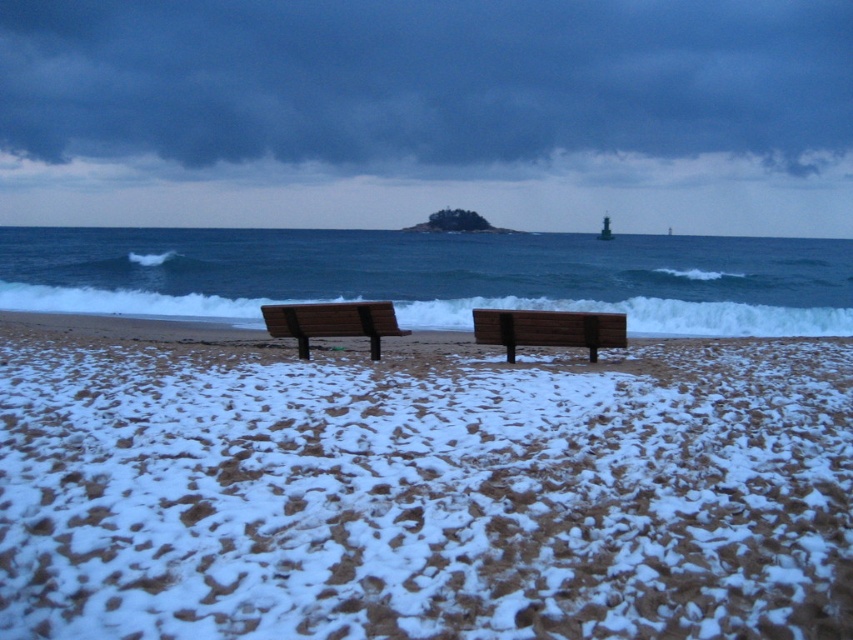
Does white foam wave at center have a smaller size compared to wooden bench at center?

No, white foam wave at center is not smaller than wooden bench at center.

Is point (247, 314) positioned before point (593, 323)?

No, (247, 314) is further to viewer.

Find the location of a particular element. white foam wave at center is located at coordinates (643, 316).

From the picture: Is white sandy beach at center shorter than white foam wave at center?

Indeed, white sandy beach at center has a lesser height compared to white foam wave at center.

From the picture: Between white sandy beach at center and white foam wave at center, which one appears on the right side from the viewer's perspective?

Positioned to the right is white sandy beach at center.

Between point (685, 472) and point (635, 332), which one is positioned in front?

Point (685, 472) is in front.

Where is `white sandy beach at center`? This screenshot has height=640, width=853. white sandy beach at center is located at coordinates (418, 486).

Is white foam wave at center wider than brown wooden bench at center?

Correct, the width of white foam wave at center exceeds that of brown wooden bench at center.

Is point (24, 289) positioned before point (323, 330)?

No, it is not.

Between point (734, 333) and point (317, 323), which one is positioned behind?

The point (734, 333) is more distant.

Find the location of a particular element. white foam wave at center is located at coordinates (643, 316).